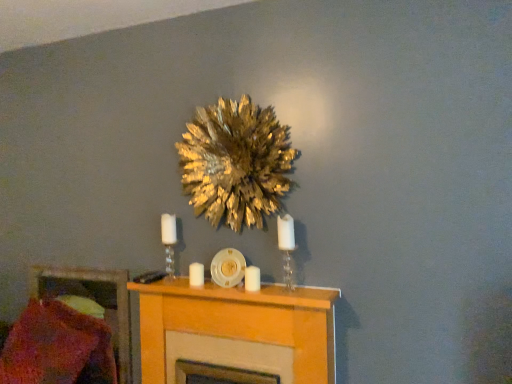
Question: Which direction should I rotate to look at white matte candle at center, arranged as the first candle when viewed from the back?

Choices:
 (A) left
 (B) right

Answer: (A)

Question: Considering the relative positions of gold leafy wreath at upper center and white glass candle holder at center, which ranks as the 2th candle holder in right-to-left order, in the image provided, is gold leafy wreath at upper center to the left of white glass candle holder at center, which ranks as the 2th candle holder in right-to-left order, from the viewer's perspective?

Choices:
 (A) no
 (B) yes

Answer: (A)

Question: Does gold leafy wreath at upper center have a greater height compared to white glass candle holder at center, positioned as the first candle holder in left-to-right order?

Choices:
 (A) no
 (B) yes

Answer: (B)

Question: Would you say gold leafy wreath at upper center is a long distance from white glass candle holder at center, the 1th candle holder when ordered from back to front?

Choices:
 (A) no
 (B) yes

Answer: (A)

Question: Considering the relative sizes of gold leafy wreath at upper center and white glass candle holder at center, which ranks as the 2th candle holder in right-to-left order, in the image provided, is gold leafy wreath at upper center thinner than white glass candle holder at center, which ranks as the 2th candle holder in right-to-left order,?

Choices:
 (A) yes
 (B) no

Answer: (B)

Question: Is gold leafy wreath at upper center positioned with its back to white glass candle holder at center, which ranks as the 2th candle holder in right-to-left order?

Choices:
 (A) no
 (B) yes

Answer: (A)

Question: Is gold leafy wreath at upper center smaller than white glass candle holder at center, the 1th candle holder when ordered from back to front?

Choices:
 (A) no
 (B) yes

Answer: (A)

Question: From a real-world perspective, is gold leafy wreath at upper center positioned under white matte candle at center, the first candle from the front, based on gravity?

Choices:
 (A) yes
 (B) no

Answer: (B)

Question: Is white matte candle at center, which is the first candle from right to left, completely or partially inside gold leafy wreath at upper center?

Choices:
 (A) no
 (B) yes

Answer: (A)

Question: Can you confirm if gold leafy wreath at upper center is smaller than white matte candle at center, the first candle from the front?

Choices:
 (A) no
 (B) yes

Answer: (A)

Question: Considering the relative sizes of gold leafy wreath at upper center and white matte candle at center, which is the first candle from right to left, in the image provided, is gold leafy wreath at upper center bigger than white matte candle at center, which is the first candle from right to left,?

Choices:
 (A) no
 (B) yes

Answer: (B)

Question: Considering the relative positions of gold leafy wreath at upper center and white matte candle at center, which is the first candle from right to left, in the image provided, is gold leafy wreath at upper center to the left of white matte candle at center, which is the first candle from right to left, from the viewer's perspective?

Choices:
 (A) no
 (B) yes

Answer: (B)

Question: From the image's perspective, does gold leafy wreath at upper center appear lower than white matte candle at center, the first candle from the front?

Choices:
 (A) no
 (B) yes

Answer: (A)

Question: Considering the relative sizes of light wood fireplace at center and white matte candle at center, marked as the 2th candle in a left-to-right arrangement, in the image provided, is light wood fireplace at center thinner than white matte candle at center, marked as the 2th candle in a left-to-right arrangement,?

Choices:
 (A) no
 (B) yes

Answer: (A)